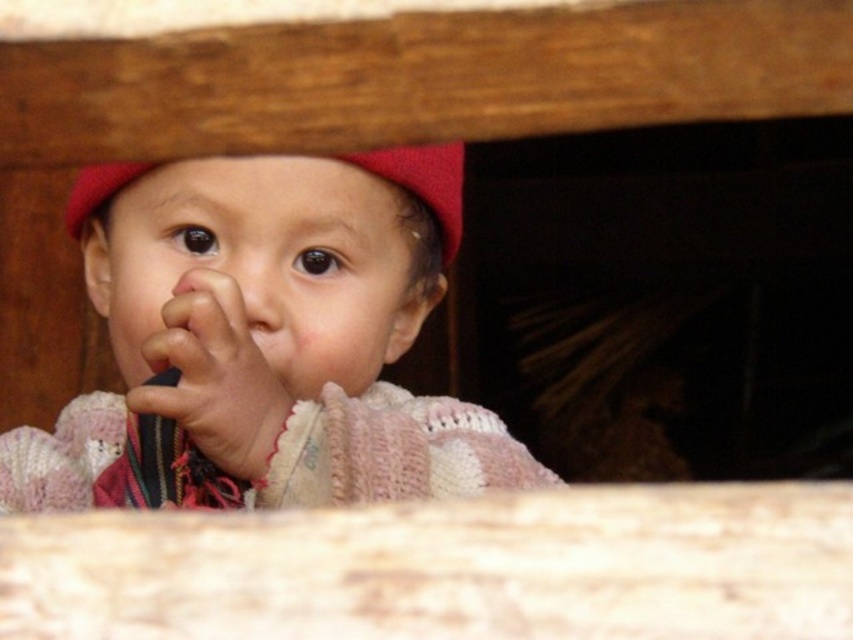
You are a photographer adjusting the focus on your camera. You want to ensure that both the knitted pink sweater at center and the red knitted hat at center are in focus. Since the sweater is closer to you, how should you adjust the focus to include both?

The knitted pink sweater at center is closer to you than the red knitted hat at center. To ensure both are in focus, adjust the focus so that the depth of field includes both the foreground and background elements, prioritizing the sweater as it is closer.

The child in the image has a soft pink fabric hand at center and a smooth flesh nose at center. Which object is positioned to the right?

The smooth flesh nose at center is positioned to the right of the soft pink fabric hand at center.

You are an artist trying to sketch the scene. Where exactly is the soft pink fabric hand at center located in terms of coordinates?

The soft pink fabric hand at center is located at coordinates point (213, 376).